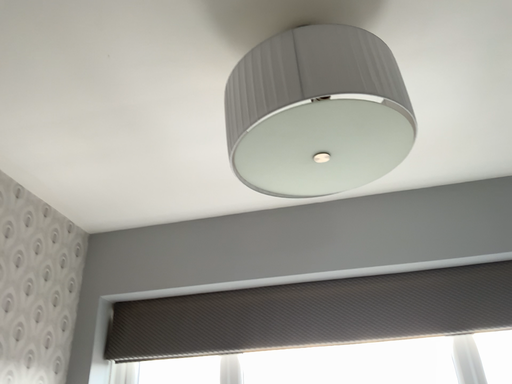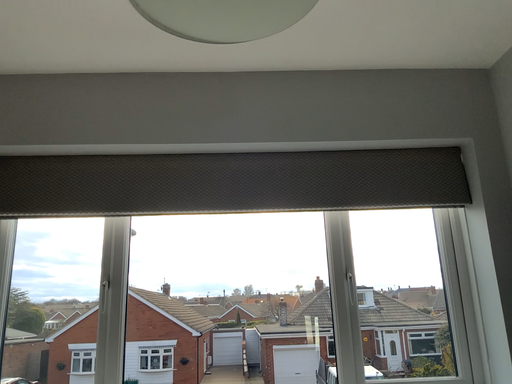
Question: Which way did the camera rotate in the video?

Choices:
 (A) rotated upward
 (B) rotated downward

Answer: (B)